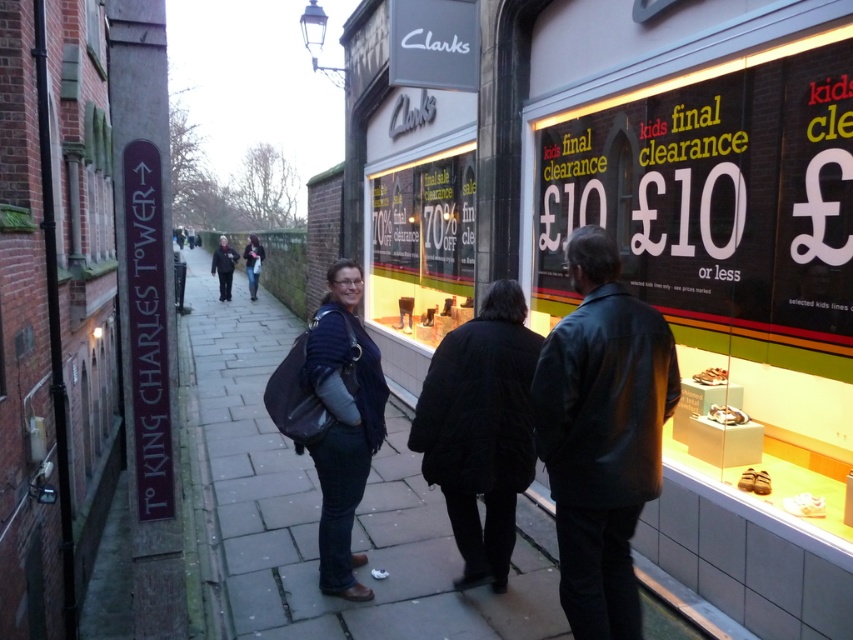
Question: Which point is farther to the camera?

Choices:
 (A) (250, 268)
 (B) (234, 259)
 (C) (445, 212)

Answer: (B)

Question: Is paved stone sidewalk at center positioned at the back of dark gray jacket at center?

Choices:
 (A) no
 (B) yes

Answer: (A)

Question: Can you confirm if black quilted coat at center is positioned to the left of dark blue denim jacket at center?

Choices:
 (A) yes
 (B) no

Answer: (B)

Question: Can you confirm if leather jacket at center is bigger than dark blue denim jacket at center?

Choices:
 (A) no
 (B) yes

Answer: (A)

Question: Which of the following is the closest to the observer?

Choices:
 (A) (583, 259)
 (B) (379, 516)
 (C) (315, 346)
 (D) (256, 252)

Answer: (A)

Question: Which object is the farthest from the black quilted coat at center?

Choices:
 (A) paved stone sidewalk at center
 (B) dark blue denim jacket at center

Answer: (A)